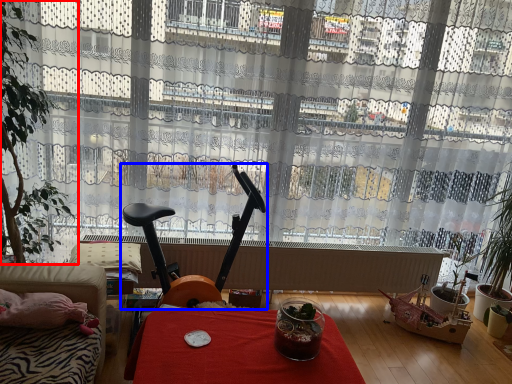
Question: Which point is further to the camera, houseplant (highlighted by a red box) or swivel chair (highlighted by a blue box)?

Choices:
 (A) houseplant
 (B) swivel chair

Answer: (B)